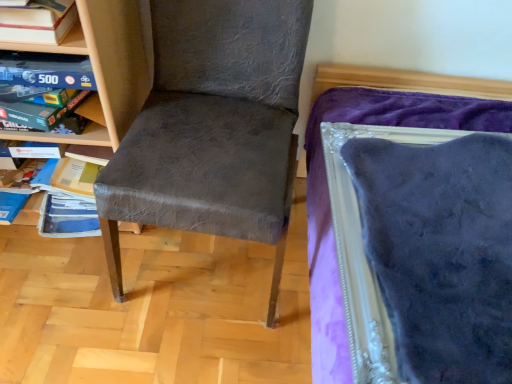
Question: Is the position of wooden board game at upper left, which ranks as the 1th shelf in back-to-front order, more distant than that of wooden bookshelf at left, which is counted as the first shelf, starting from the front?

Choices:
 (A) no
 (B) yes

Answer: (B)

Question: Is wooden board game at upper left, the second shelf positioned from the front, bigger than wooden bookshelf at left, which is counted as the 2th shelf, starting from the back?

Choices:
 (A) yes
 (B) no

Answer: (B)

Question: Is wooden board game at upper left, which ranks as the 1th shelf in back-to-front order, beside wooden bookshelf at left, which is counted as the first shelf, starting from the front?

Choices:
 (A) yes
 (B) no

Answer: (A)

Question: Is wooden board game at upper left, which ranks as the 1th shelf in back-to-front order, facing away from wooden bookshelf at left, which is counted as the first shelf, starting from the front?

Choices:
 (A) no
 (B) yes

Answer: (B)

Question: Is the depth of wooden board game at upper left, which ranks as the 1th shelf in back-to-front order, less than that of wooden bookshelf at left, which is counted as the 2th shelf, starting from the back?

Choices:
 (A) yes
 (B) no

Answer: (B)

Question: From a real-world perspective, is wooden board game at upper left, which ranks as the 1th shelf in back-to-front order, positioned under wooden bookshelf at left, which is counted as the 2th shelf, starting from the back, based on gravity?

Choices:
 (A) yes
 (B) no

Answer: (B)

Question: From the image's perspective, is matte gray chair at center on wooden bookshelf at left, which is counted as the 2th shelf, starting from the back?

Choices:
 (A) yes
 (B) no

Answer: (B)

Question: Can you confirm if matte gray chair at center is thinner than wooden bookshelf at left, which is counted as the 2th shelf, starting from the back?

Choices:
 (A) no
 (B) yes

Answer: (A)

Question: Can you confirm if matte gray chair at center is smaller than wooden bookshelf at left, which is counted as the 2th shelf, starting from the back?

Choices:
 (A) yes
 (B) no

Answer: (B)

Question: Is matte gray chair at center wider than wooden bookshelf at left, which is counted as the first shelf, starting from the front?

Choices:
 (A) no
 (B) yes

Answer: (B)

Question: From a real-world perspective, is matte gray chair at center below wooden bookshelf at left, which is counted as the 2th shelf, starting from the back?

Choices:
 (A) yes
 (B) no

Answer: (B)

Question: Is matte gray chair at center at the left side of wooden bookshelf at left, which is counted as the first shelf, starting from the front?

Choices:
 (A) no
 (B) yes

Answer: (A)

Question: Considering the relative sizes of wooden bookshelf at left, which is counted as the 2th shelf, starting from the back, and matte gray chair at center in the image provided, is wooden bookshelf at left, which is counted as the 2th shelf, starting from the back, smaller than matte gray chair at center?

Choices:
 (A) no
 (B) yes

Answer: (B)